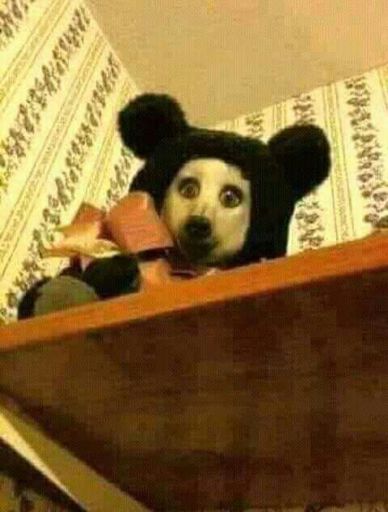
Where is `wall`? wall is located at coordinates (360, 169).